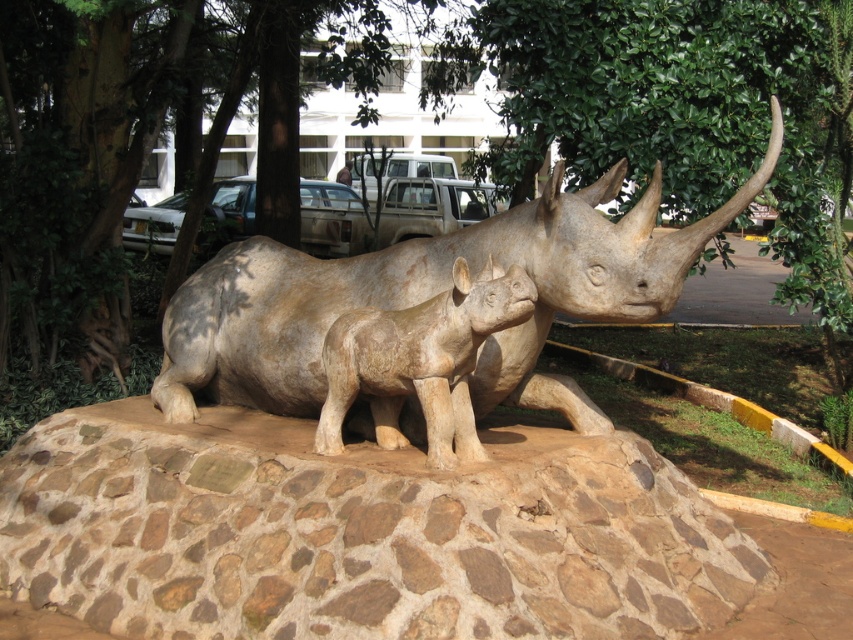
Question: Among these objects, which one is farthest from the camera?

Choices:
 (A) matte stone rhinoceros at center
 (B) matte beige rhino at center
 (C) brown stone at center

Answer: (B)

Question: In this image, where is matte stone rhinoceros at center located relative to matte beige rhino at center?

Choices:
 (A) right
 (B) left

Answer: (A)

Question: Does matte stone rhinoceros at center appear over matte beige rhino at center?

Choices:
 (A) no
 (B) yes

Answer: (B)

Question: Estimate the real-world distances between objects in this image. Which object is farther from the matte stone rhinoceros at center?

Choices:
 (A) brown stone at center
 (B) matte beige rhino at center

Answer: (A)

Question: Is brown stone at center positioned in front of matte beige rhino at center?

Choices:
 (A) yes
 (B) no

Answer: (A)

Question: Which of the following is the farthest from the observer?

Choices:
 (A) (167, 502)
 (B) (312, 364)
 (C) (447, 420)

Answer: (B)